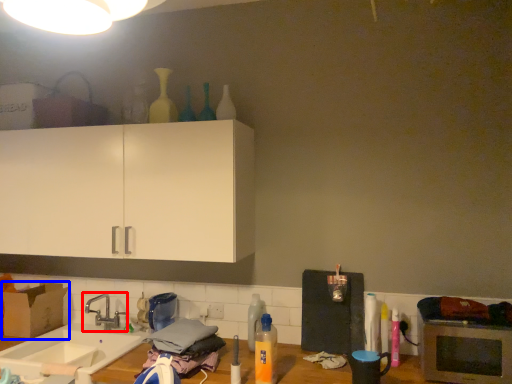
Question: Which of the following is the farthest to the observer, tap (highlighted by a red box) or cardboard box (highlighted by a blue box)?

Choices:
 (A) tap
 (B) cardboard box

Answer: (B)